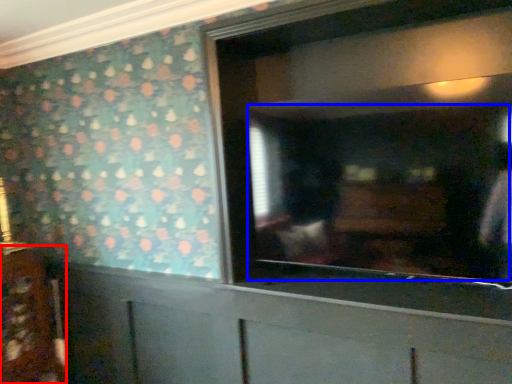
Question: Which object is closer to the camera taking this photo, cabinetry (highlighted by a red box) or mirror (highlighted by a blue box)?

Choices:
 (A) cabinetry
 (B) mirror

Answer: (B)